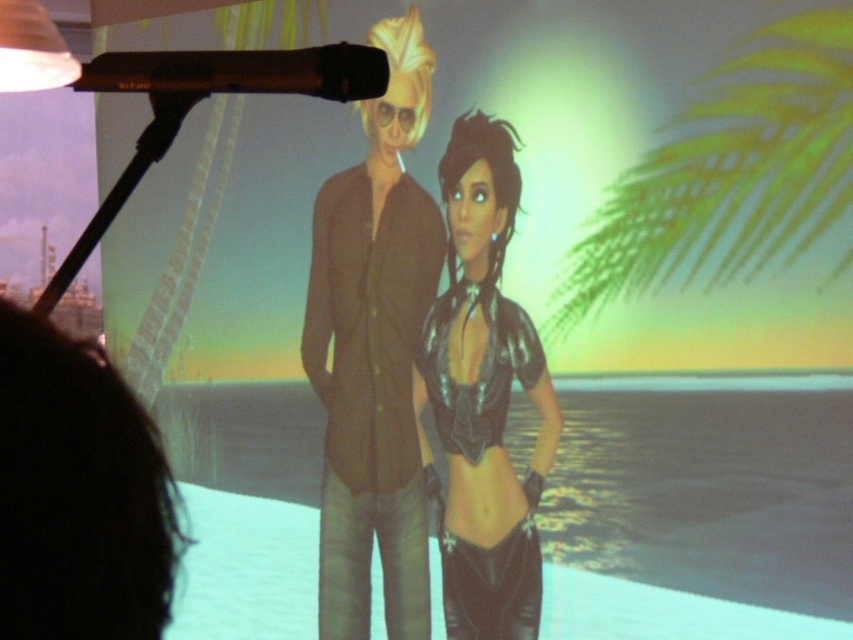
You are a stagehand adjusting the lighting for the performance. You need to ensure that the shiny metallic top at center doesn not reflect the black matte microphone at upper left. Which object should you avoid shining light on to prevent this reflection?

To prevent the shiny metallic top at center from reflecting the black matte microphone at upper left, avoid shining light directly on the shiny metallic top at center.

Consider the image. You are a stagehand setting up for a performance. You need to ensure that the black matte microphone at upper left and the matte white lampshade at upper left are positioned correctly. Given their sizes, which object should be placed closer to the front of the stage to ensure visibility?

The black matte microphone at upper left has a smaller size compared to the matte white lampshade at upper left. To ensure visibility, the smaller black matte microphone at upper left should be placed closer to the front of the stage.

Consider the image. You are a photographer adjusting the camera focus on a stage with a tropical theme. There are two performers on the stage. The person on the left is wearing a dark brown buttoned shirt and light pants, while the one on the right has dark textured hair. Your camera has a focus point at the coordinates point (485, 396). Based on the scene description, which object should you focus on to capture the shiny metallic top at the center of the image?

The point (485, 396) indicates the shiny metallic top at center, so you should focus on the shiny metallic top at center to capture it clearly.